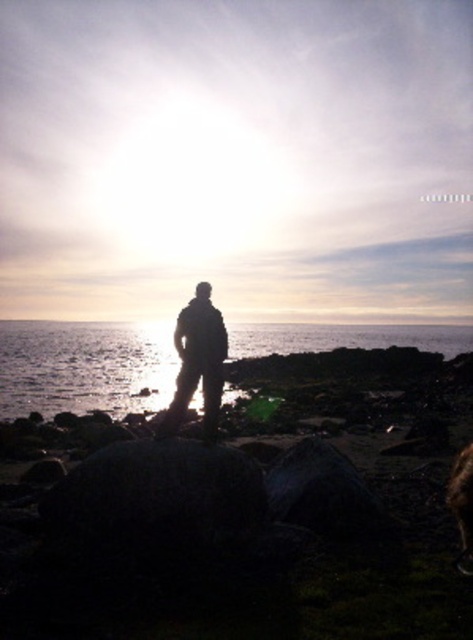
Which is more to the right, transparent water at center or silhouette fabric at center?

Positioned to the right is silhouette fabric at center.

Between transparent water at center and silhouette fabric at center, which one appears on the left side from the viewer's perspective?

transparent water at center is more to the left.

Who is more forward, (x=456, y=337) or (x=218, y=362)?

Point (x=218, y=362)

The width and height of the screenshot is (473, 640). Identify the location of transparent water at center. (85, 365).

Which is more to the right, transparent water at center or fuzzy brown dog at lower right?

fuzzy brown dog at lower right

At what (x,y) coordinates should I click in order to perform the action: click on transparent water at center. Please return your answer as a coordinate pair (x, y). This screenshot has width=473, height=640. Looking at the image, I should click on (85, 365).

Between point (136, 385) and point (461, 540), which one is positioned behind?

The point (136, 385) is more distant.

Find the location of a particular element. The height and width of the screenshot is (640, 473). transparent water at center is located at coordinates (85, 365).

Who is more forward, (221, 378) or (466, 472)?

Point (466, 472)

Who is more distant from viewer, (177, 396) or (464, 497)?

The point (177, 396) is behind.

Does point (185, 365) come in front of point (461, 504)?

No, it is not.

Locate an element on the screen. silhouette fabric at center is located at coordinates (198, 362).